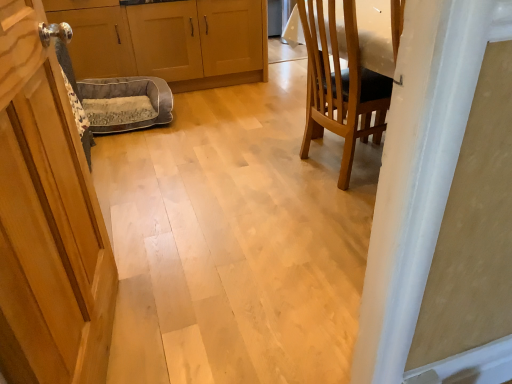
Question: Considering the positions of wooden cabinet at left, the first cabinetry when ordered from left to right, and gray fabric dog bed at center in the image, is wooden cabinet at left, the first cabinetry when ordered from left to right, bigger or smaller than gray fabric dog bed at center?

Choices:
 (A) small
 (B) big

Answer: (B)

Question: Is wooden cabinet at left, the first cabinetry when ordered from left to right, wider or thinner than gray fabric dog bed at center?

Choices:
 (A) thin
 (B) wide

Answer: (B)

Question: Based on their relative distances, which object is farther from the wooden cabinet at left, the first cabinetry when ordered from left to right?

Choices:
 (A) wooden chair at right
 (B) matte wood cabinets at center, positioned as the first cabinetry in right-to-left order
 (C) wooden door at left
 (D) gray fabric dog bed at center

Answer: (C)

Question: Which object is positioned closest to the wooden door at left?

Choices:
 (A) gray fabric dog bed at center
 (B) wooden chair at right
 (C) wooden cabinet at left, the first cabinetry when ordered from left to right
 (D) matte wood cabinets at center, acting as the 2th cabinetry starting from the left

Answer: (B)